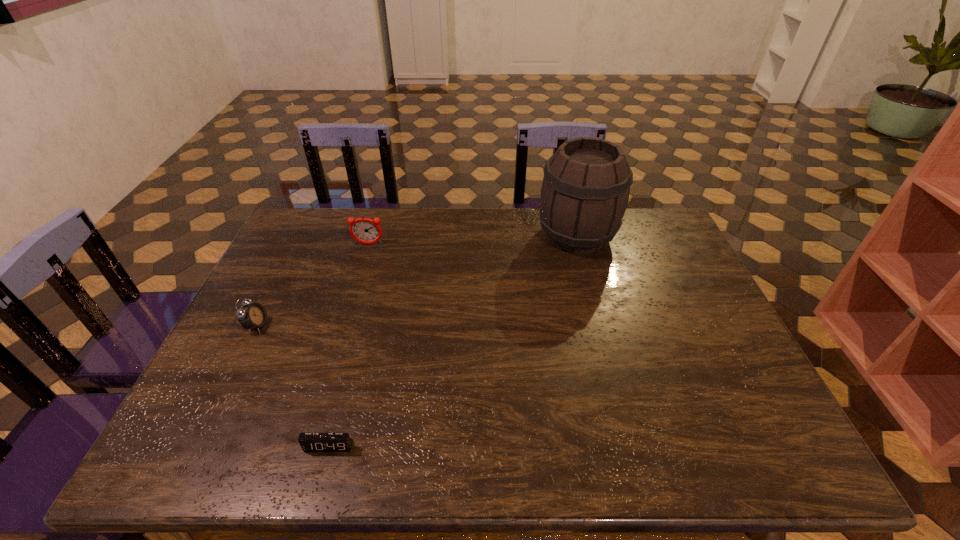
In order to click on vacant region located on the face of the leftmost object in this screenshot , I will do `click(415, 326)`.

Identify the location of wine bucket at the far edge. The image size is (960, 540). (585, 190).

The width and height of the screenshot is (960, 540). In order to click on alarm clock situated at the far edge in this screenshot , I will do `click(364, 230)`.

The width and height of the screenshot is (960, 540). I want to click on object that is positioned at the near edge, so click(x=310, y=442).

In order to click on object situated at the left edge in this screenshot , I will do `click(252, 316)`.

What are the coordinates of `free space at the far edge` in the screenshot? It's located at (391, 220).

Locate an element on the screen. The width and height of the screenshot is (960, 540). vacant area at the near edge is located at coordinates (394, 429).

The width and height of the screenshot is (960, 540). Find the location of `free location at the left edge`. free location at the left edge is located at coordinates (255, 413).

In the image, there is a desktop. Where is `vacant space at the right edge`? vacant space at the right edge is located at coordinates (700, 280).

Where is `free space at the far left corner`? free space at the far left corner is located at coordinates (339, 214).